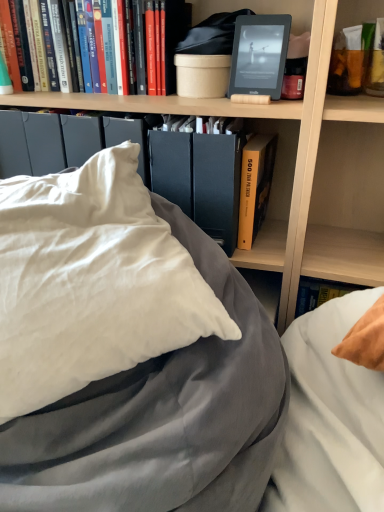
What are the coordinates of `yellow hardcover book at center, marked as the first book in a bottom-to-top arrangement` in the screenshot? It's located at (255, 186).

Locate an element on the screen. This screenshot has width=384, height=512. matte orange tube at upper right, the first book in the right-to-left sequence is located at coordinates (351, 59).

What is the approximate width of white satin pillow at center?

white satin pillow at center is 29.35 inches in width.

At what (x,y) coordinates should I click in order to perform the action: click on white satin pillow at center. Please return your answer as a coordinate pair (x, y). The image size is (384, 512). Looking at the image, I should click on (128, 352).

You are a GUI agent. You are given a task and a screenshot of the screen. Output one action in this format:
    pyautogui.click(x=<x>, y=<y>)
    Task: Click on the matte black kindle at upper center, which is the 2th paperback book in bottom-to-top order
    
    Given the screenshot: What is the action you would take?
    pyautogui.click(x=259, y=54)

In the scene shown: Is white satin pillow at center surrounded by wooden bookshelf at upper center?

No, white satin pillow at center is not inside wooden bookshelf at upper center.

From a real-world perspective, which object stands above the other?

In real-world perspective, wooden bookshelf at upper center is above.

From the image's perspective, which one is positioned higher, wooden bookshelf at upper center or white satin pillow at center?

wooden bookshelf at upper center appears higher in the image.

Does matte orange tube at upper right, marked as the second book in a bottom-to-top arrangement, come behind matte black folder at center, which appears as the 1th paperback book when ordered from the bottom?

Yes, matte orange tube at upper right, marked as the second book in a bottom-to-top arrangement, is further from the viewer.

Could you tell me if matte orange tube at upper right, which is the 3th book in left-to-right order, is facing matte black folder at center, which appears as the 1th paperback book when ordered from the bottom?

No, matte orange tube at upper right, which is the 3th book in left-to-right order, is not facing towards matte black folder at center, which appears as the 1th paperback book when ordered from the bottom.

Which object is positioned more to the left, matte orange tube at upper right, the first book in the right-to-left sequence, or matte black folder at center, the 2th paperback book from the top?

matte black folder at center, the 2th paperback book from the top, is more to the left.

Is matte orange tube at upper right, which is the 3th book in left-to-right order, shorter than matte black folder at center, the 2th paperback book from the top?

Correct, matte orange tube at upper right, which is the 3th book in left-to-right order, is not as tall as matte black folder at center, the 2th paperback book from the top.

Locate an element on the screen. bookcase in front of the matte orange tube at upper right, the first book in the right-to-left sequence is located at coordinates (297, 157).

Are wooden bookshelf at upper center and matte orange tube at upper right, which appears as the second book when viewed from the top, located far from each other?

wooden bookshelf at upper center is actually quite close to matte orange tube at upper right, which appears as the second book when viewed from the top.

From the image's perspective, who appears lower, wooden bookshelf at upper center or matte orange tube at upper right, marked as the second book in a bottom-to-top arrangement?

wooden bookshelf at upper center is shown below in the image.

Who is more distant, wooden bookshelf at upper center or matte orange tube at upper right, the first book in the right-to-left sequence?

matte orange tube at upper right, the first book in the right-to-left sequence, is behind.

Consider the image. Does wooden bookshelf at upper center appear on the left side of hardcover book at upper left, acting as the third book starting from the right?

In fact, wooden bookshelf at upper center is to the right of hardcover book at upper left, acting as the third book starting from the right.

From the image's perspective, which object appears higher, wooden bookshelf at upper center or hardcover book at upper left, acting as the third book starting from the right?

hardcover book at upper left, acting as the third book starting from the right, is shown above in the image.

Considering the sizes of objects wooden bookshelf at upper center and hardcover book at upper left, acting as the third book starting from the right, in the image provided, who is bigger, wooden bookshelf at upper center or hardcover book at upper left, acting as the third book starting from the right,?

wooden bookshelf at upper center is bigger.

Is point (338, 149) positioned before point (74, 24)?

No, (338, 149) is behind (74, 24).

Is matte black folder at center, which appears as the 1th paperback book when ordered from the bottom, shorter than white satin pillow at center?

Correct, matte black folder at center, which appears as the 1th paperback book when ordered from the bottom, is not as tall as white satin pillow at center.

Considering the sizes of objects matte black folder at center, which appears as the 1th paperback book when ordered from the bottom, and white satin pillow at center in the image provided, who is wider, matte black folder at center, which appears as the 1th paperback book when ordered from the bottom, or white satin pillow at center?

With larger width is white satin pillow at center.

Between point (208, 135) and point (30, 485), which one is positioned in front?

Point (30, 485)

Would you say matte black kindle at upper center, which is the 2th paperback book in bottom-to-top order, is to the left or to the right of hardcover book at upper left, acting as the third book starting from the right, in the picture?

Based on their positions, matte black kindle at upper center, which is the 2th paperback book in bottom-to-top order, is located to the right of hardcover book at upper left, acting as the third book starting from the right.

Considering the sizes of objects matte black kindle at upper center, which is the 2th paperback book in bottom-to-top order, and hardcover book at upper left, which is counted as the first book, starting from the top, in the image provided, who is shorter, matte black kindle at upper center, which is the 2th paperback book in bottom-to-top order, or hardcover book at upper left, which is counted as the first book, starting from the top,?

matte black kindle at upper center, which is the 2th paperback book in bottom-to-top order, is shorter.

From the image's perspective, would you say matte black kindle at upper center, placed as the 1th paperback book when sorted from top to bottom, is positioned over hardcover book at upper left, acting as the third book starting from the right?

No, from the image's perspective, matte black kindle at upper center, placed as the 1th paperback book when sorted from top to bottom, is not over hardcover book at upper left, acting as the third book starting from the right.

Who is more distant, matte black kindle at upper center, placed as the 1th paperback book when sorted from top to bottom, or hardcover book at upper left, the third book when ordered from bottom to top?

Positioned behind is hardcover book at upper left, the third book when ordered from bottom to top.

Is point (206, 163) positioned after point (253, 180)?

No, it is not.

In terms of height, does matte black folder at center, the 2th paperback book from the top, look taller or shorter compared to yellow hardcover book at center, positioned as the 2th book in left-to-right order?

matte black folder at center, the 2th paperback book from the top, is taller than yellow hardcover book at center, positioned as the 2th book in left-to-right order.

At what (x,y) coordinates should I click in order to perform the action: click on book below the matte black folder at center, the 2th paperback book from the top (from a real-world perspective). Please return your answer as a coordinate pair (x, y). This screenshot has height=512, width=384. Looking at the image, I should click on (255, 186).

Where is `bookcase on the right of the white satin pillow at center`? This screenshot has width=384, height=512. bookcase on the right of the white satin pillow at center is located at coordinates (297, 157).

Find the location of a particular element. the 1st book behind when counting from the matte black folder at center, the 2th paperback book from the top is located at coordinates (351, 59).

When comparing their distances from wooden bookshelf at upper center, does matte black folder at center, which appears as the 1th paperback book when ordered from the bottom, or yellow hardcover book at center, the 2th book from the right, seem closer?

Among the two, yellow hardcover book at center, the 2th book from the right, is located nearer to wooden bookshelf at upper center.

From the image, which object appears to be farther from matte black folder at center, which appears as the 1th paperback book when ordered from the bottom, yellow hardcover book at center, marked as the first book in a bottom-to-top arrangement, or matte black kindle at upper center, which is the 2th paperback book in bottom-to-top order?

Among the two, matte black kindle at upper center, which is the 2th paperback book in bottom-to-top order, is located further to matte black folder at center, which appears as the 1th paperback book when ordered from the bottom.

When comparing their distances from wooden bookshelf at upper center, does matte black folder at center, the 2th paperback book from the top, or matte black kindle at upper center, which is the 2th paperback book in bottom-to-top order, seem closer?

The object closer to wooden bookshelf at upper center is matte black folder at center, the 2th paperback book from the top.

Considering their positions, is wooden bookshelf at upper center positioned closer to white satin pillow at center than hardcover book at upper left, arranged as the 1th book when viewed from the left?

Based on the image, wooden bookshelf at upper center appears to be nearer to white satin pillow at center.

Estimate the real-world distances between objects in this image. Which object is further from matte black folder at center, the 2th paperback book from the top, yellow hardcover book at center, the 2th book from the right, or matte orange tube at upper right, the first book in the right-to-left sequence?

matte orange tube at upper right, the first book in the right-to-left sequence, lies further to matte black folder at center, the 2th paperback book from the top, than the other object.

Which object lies nearer to the anchor point matte black folder at center, the 2th paperback book from the top, white satin pillow at center or yellow hardcover book at center, the 3th book when ordered from top to bottom?

yellow hardcover book at center, the 3th book when ordered from top to bottom, is positioned closer to the anchor matte black folder at center, the 2th paperback book from the top.

Based on their spatial positions, is white satin pillow at center or matte black folder at center, which appears as the 1th paperback book when ordered from the bottom, further from wooden bookshelf at upper center?

white satin pillow at center is positioned further to the anchor wooden bookshelf at upper center.

From the image, which object appears to be nearer to wooden bookshelf at upper center, matte black folder at center, which appears as the 1th paperback book when ordered from the bottom, or hardcover book at upper left, arranged as the 1th book when viewed from the left?

matte black folder at center, which appears as the 1th paperback book when ordered from the bottom.

The image size is (384, 512). In order to click on bookcase that lies between matte black kindle at upper center, placed as the 1th paperback book when sorted from top to bottom, and yellow hardcover book at center, the 2th book from the right, from top to bottom in this screenshot , I will do `click(297, 157)`.

This screenshot has width=384, height=512. I want to click on bookcase situated between hardcover book at upper left, acting as the third book starting from the right, and matte orange tube at upper right, which appears as the second book when viewed from the top, from left to right, so click(x=297, y=157).

At what (x,y) coordinates should I click in order to perform the action: click on bookcase between hardcover book at upper left, the third book when ordered from bottom to top, and yellow hardcover book at center, the 3th book when ordered from top to bottom, from top to bottom. Please return your answer as a coordinate pair (x, y). The image size is (384, 512). Looking at the image, I should click on click(x=297, y=157).

Where is `bookcase between matte black kindle at upper center, which is the 2th paperback book in bottom-to-top order, and white satin pillow at center vertically`? This screenshot has width=384, height=512. bookcase between matte black kindle at upper center, which is the 2th paperback book in bottom-to-top order, and white satin pillow at center vertically is located at coordinates (297, 157).